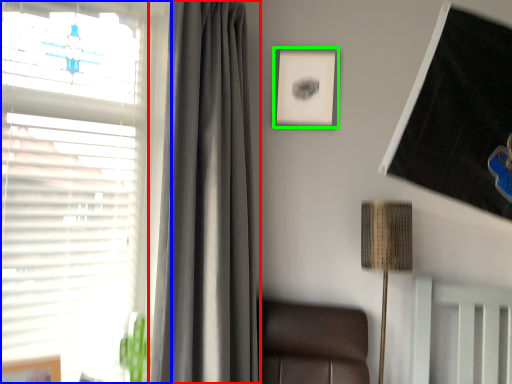
Question: Which is nearer to the curtain (highlighted by a red box)? window (highlighted by a blue box) or picture frame (highlighted by a green box).

Choices:
 (A) window
 (B) picture frame

Answer: (A)